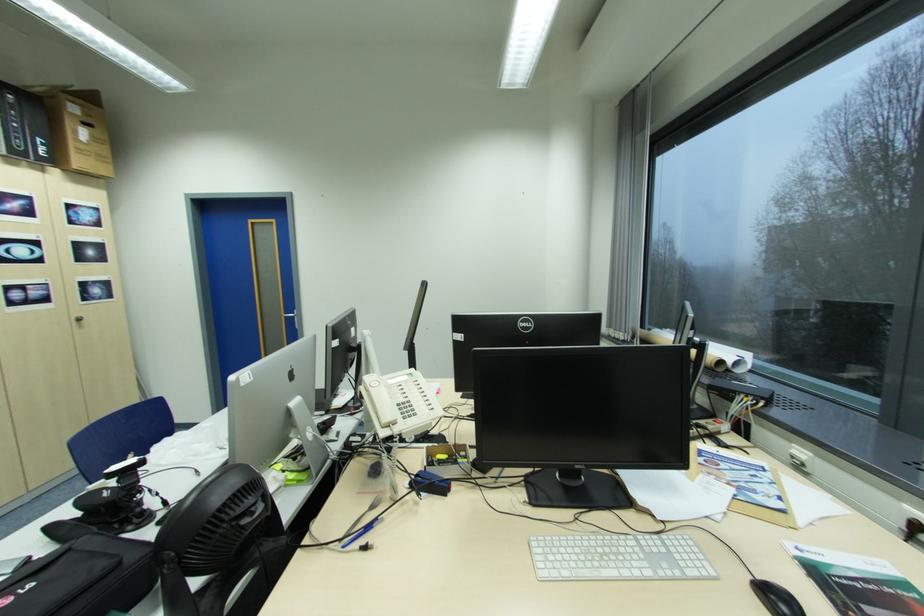
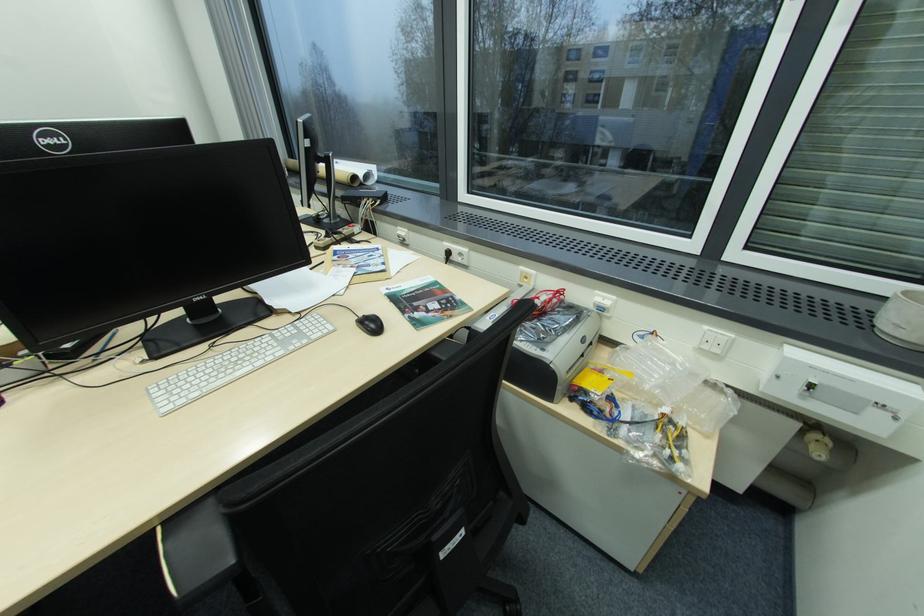
The point at [719,480] is marked in the first image. Where is the corresponding point in the second image?

(346, 270)